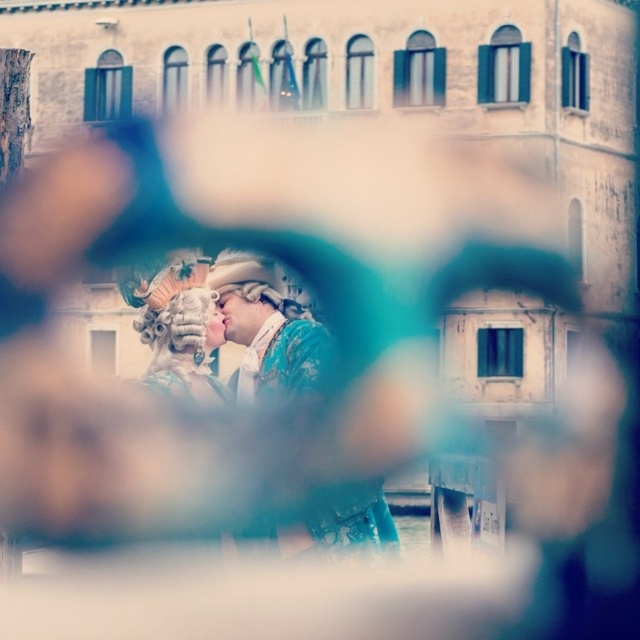
Between shiny gold mask at center and matte gold mask at center, which one appears on the left side from the viewer's perspective?

From the viewer's perspective, matte gold mask at center appears more on the left side.

The height and width of the screenshot is (640, 640). I want to click on shiny gold mask at center, so click(268, 326).

You are a GUI agent. You are given a task and a screenshot of the screen. Output one action in this format:
    pyautogui.click(x=<x>, y=<y>)
    Task: Click on the shiny gold mask at center
    The image size is (640, 640).
    Given the screenshot: What is the action you would take?
    pyautogui.click(x=268, y=326)